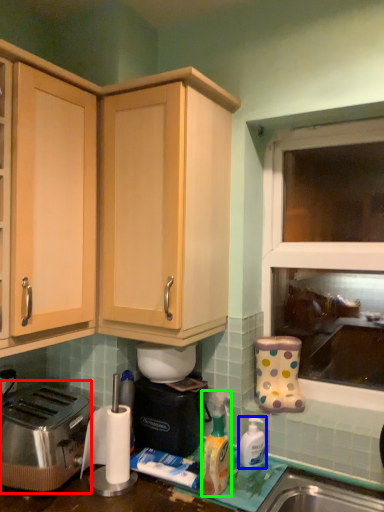
Question: Which object is positioned closest to toaster (highlighted by a red box)? Select from bottle (highlighted by a blue box) and bottle (highlighted by a green box).

Choices:
 (A) bottle
 (B) bottle

Answer: (B)